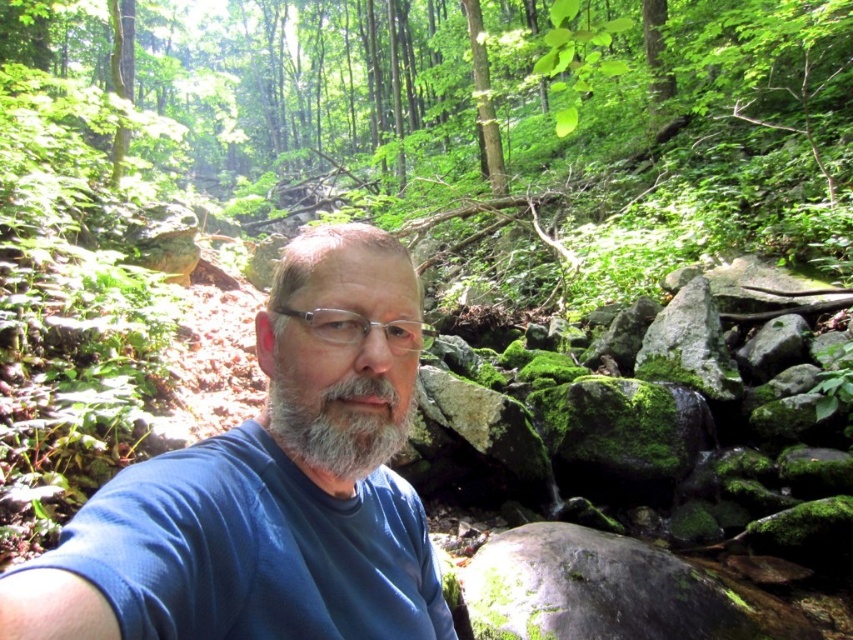
You are a photographer analyzing the forest selfie scene. The man has a gray matte beard at center and clear plastic glasses at center. Which object is closer to the camera?

The gray matte beard at center is closer to the camera because it is in front of the clear plastic glasses at center.

You are a photographer trying to capture the man in the forest. You notice the blue fabric shirt at center and the gray matte beard at center. Which object is positioned lower on the man?

The blue fabric shirt at center is below gray matte beard at center, so the blue fabric shirt at center is positioned lower on the man.